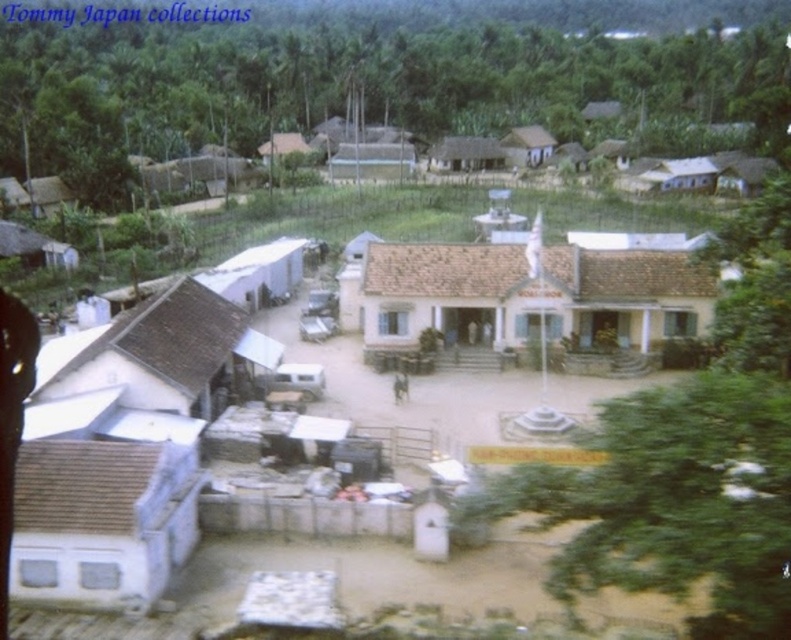
Question: Which object appears closest to the camera in this image?

Choices:
 (A) white matte building at center
 (B) white matte hut at lower left

Answer: (B)

Question: Which object appears closest to the camera in this image?

Choices:
 (A) white matte building at center
 (B) white matte hut at lower left

Answer: (B)

Question: Is white matte building at center wider than white matte hut at lower left?

Choices:
 (A) no
 (B) yes

Answer: (B)

Question: Can you confirm if white matte building at center is thinner than white matte hut at lower left?

Choices:
 (A) no
 (B) yes

Answer: (A)

Question: Is white matte building at center positioned before white matte hut at lower left?

Choices:
 (A) no
 (B) yes

Answer: (A)

Question: Which of the following is the farthest from the observer?

Choices:
 (A) (59, 465)
 (B) (517, 284)

Answer: (B)